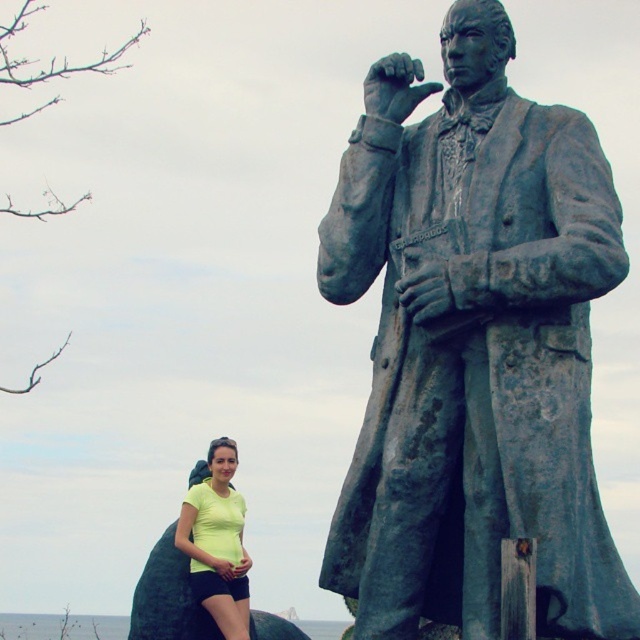
Which of these two, bronze statue at right or yellow matte shirt at lower left, stands shorter?

yellow matte shirt at lower left is shorter.

Is point (586, 625) more distant than point (209, 500)?

No, (586, 625) is closer to viewer.

This screenshot has width=640, height=640. Describe the element at coordinates (474, 348) in the screenshot. I see `bronze statue at right` at that location.

Locate an element on the screen. bronze statue at right is located at coordinates (474, 348).